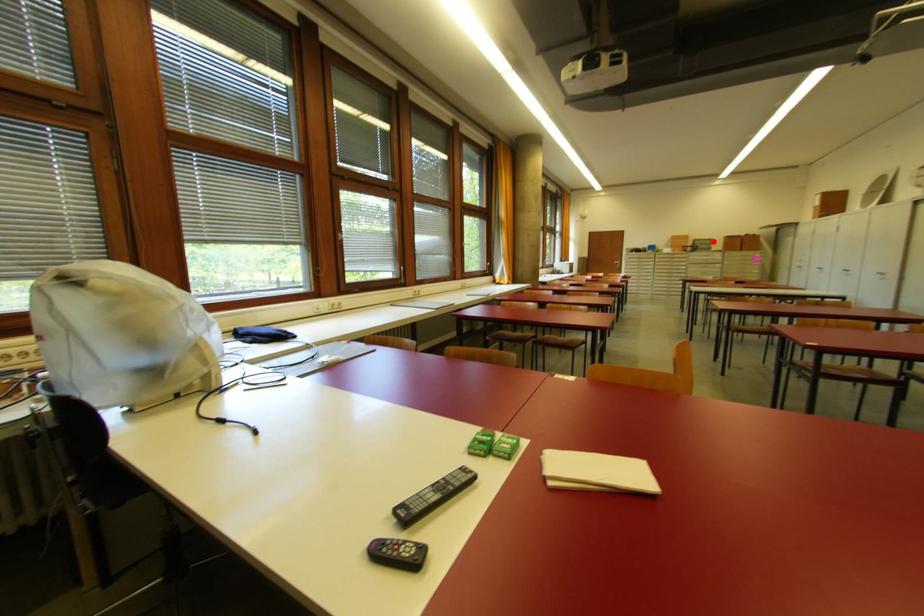
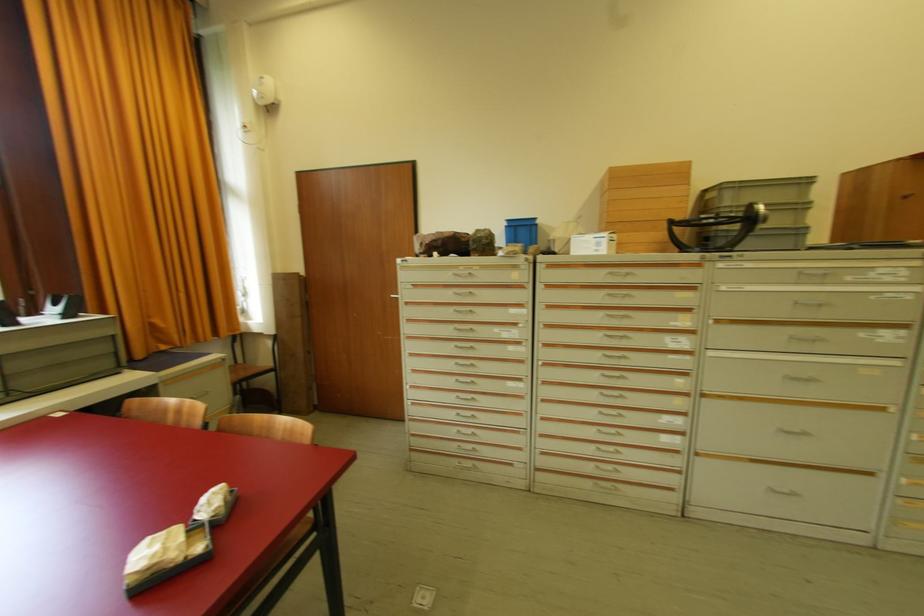
In the second image, find the point that corresponds to the highlighted location in the first image.

(809, 184)